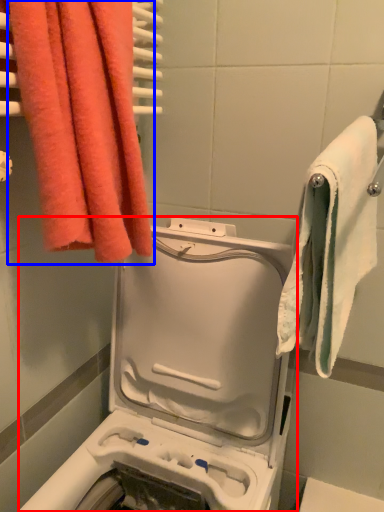
Question: Which object is closer to the camera taking this photo, washing machine (highlighted by a red box) or towel (highlighted by a blue box)?

Choices:
 (A) washing machine
 (B) towel

Answer: (A)